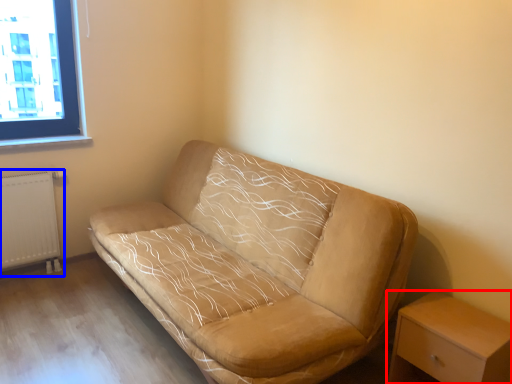
Question: Which of the following is the farthest to the observer, nightstand (highlighted by a red box) or radiator (highlighted by a blue box)?

Choices:
 (A) nightstand
 (B) radiator

Answer: (B)